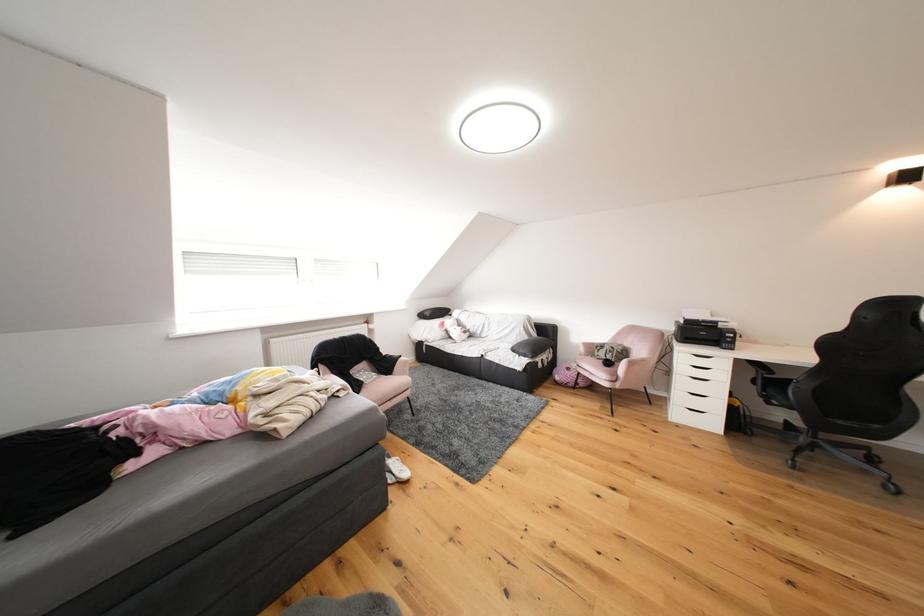
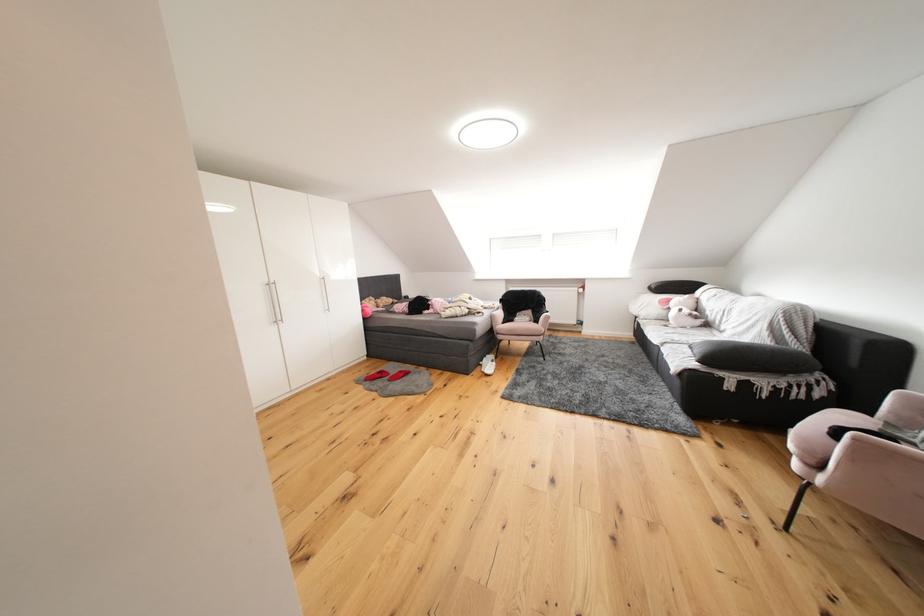
Locate, in the second image, the point that corresponds to (x=453, y=328) in the first image.

(677, 305)